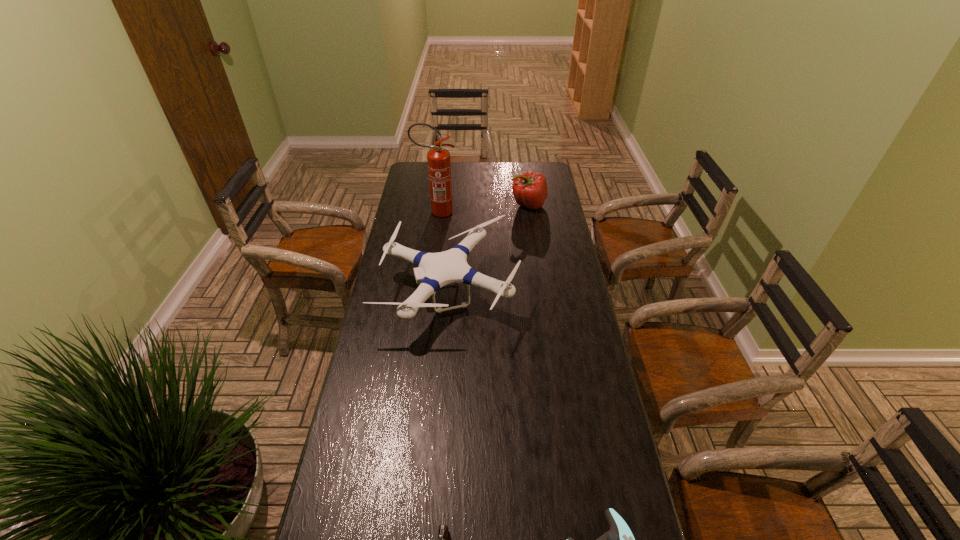
Locate an element on the screen. vacant space that satisfies the following two spatial constraints: 1. from the nozzle of the third farthest object; 2. on the right side of the tallest object is located at coordinates (426, 291).

Image resolution: width=960 pixels, height=540 pixels. I want to click on free space that satisfies the following two spatial constraints: 1. on the back side of the drone; 2. on the right side of the bell pepper, so click(457, 205).